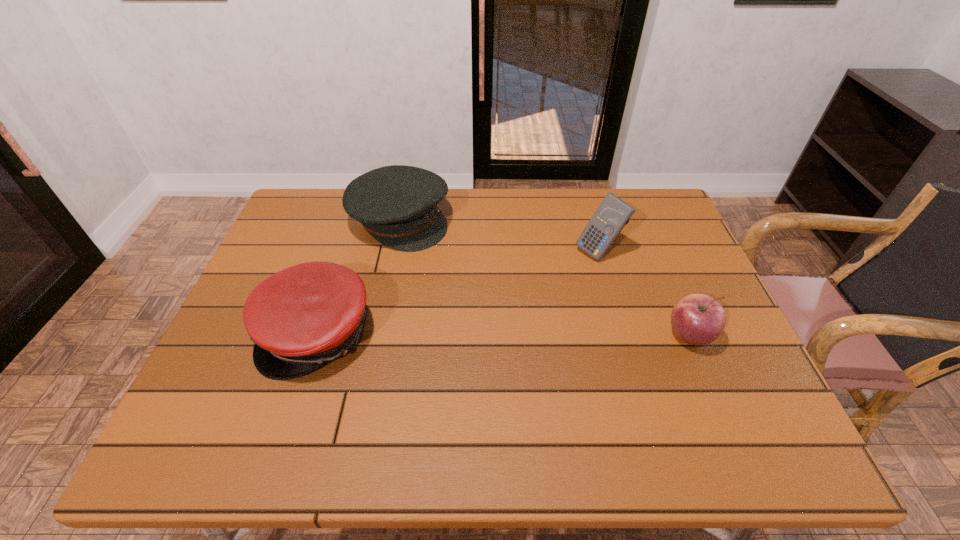
Identify the location of vacant spot on the desktop that is between the cap and the apple and is positioned on the front-facing side of the beret. (558, 335).

Identify the location of vacant space on the desktop that is between the cap and the apple and is positioned on the front-facing side of the tallest object. Image resolution: width=960 pixels, height=540 pixels. (468, 334).